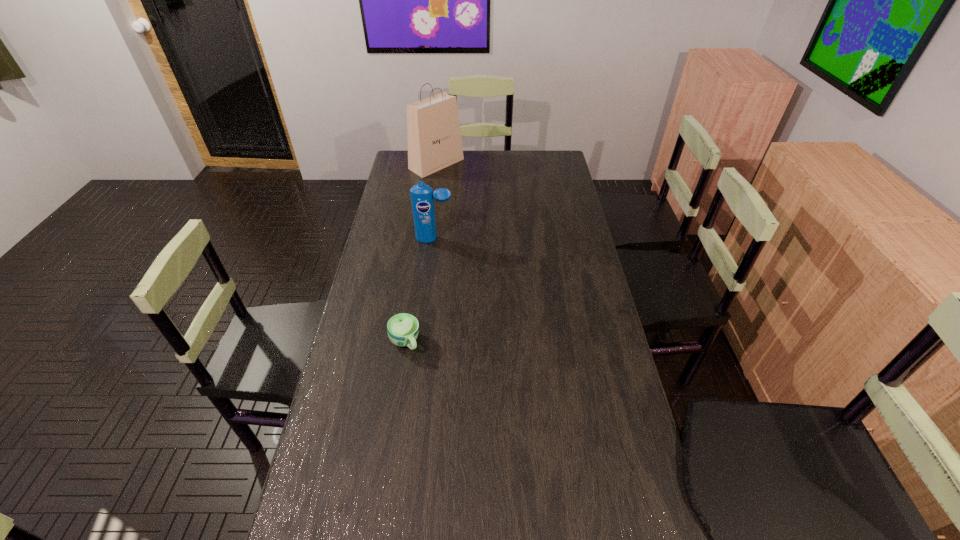
Find the location of a particular element. The height and width of the screenshot is (540, 960). shopping bag is located at coordinates (434, 139).

Identify the location of the farthest object. (434, 139).

Find the location of a particular element. Image resolution: width=960 pixels, height=540 pixels. the second farthest object is located at coordinates (422, 195).

Locate an element on the screen. This screenshot has width=960, height=540. shampoo is located at coordinates (422, 195).

Where is `the nearest object`? This screenshot has height=540, width=960. the nearest object is located at coordinates (402, 328).

The image size is (960, 540). I want to click on cup, so click(402, 328).

Find the location of a particular element. free space located 0.100m on the right of the tallest object is located at coordinates (485, 164).

This screenshot has width=960, height=540. I want to click on free spot located on the right of the shampoo, so click(x=473, y=239).

Find the location of a particular element. vacant space located on the back of the shortest object is located at coordinates (419, 251).

The image size is (960, 540). What are the coordinates of `object that is at the far edge` in the screenshot? It's located at (434, 139).